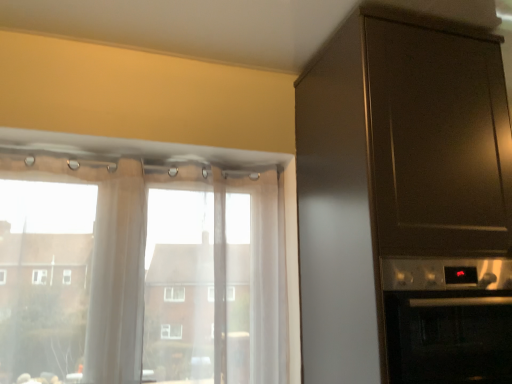
Question: Looking at the image, does satin silver oven at right seem bigger or smaller compared to translucent fabric at left?

Choices:
 (A) big
 (B) small

Answer: (A)

Question: Looking at their shapes, would you say satin silver oven at right is wider or thinner than translucent fabric at left?

Choices:
 (A) thin
 (B) wide

Answer: (B)

Question: Based on their relative distances, which object is nearer to the metallic dark brown cabinet at right?

Choices:
 (A) satin silver oven at right
 (B) sheer white curtain at left
 (C) translucent fabric at left

Answer: (A)

Question: Considering the real-world distances, which object is closest to the translucent fabric at left?

Choices:
 (A) satin silver oven at right
 (B) metallic dark brown cabinet at right
 (C) sheer white curtain at left

Answer: (C)